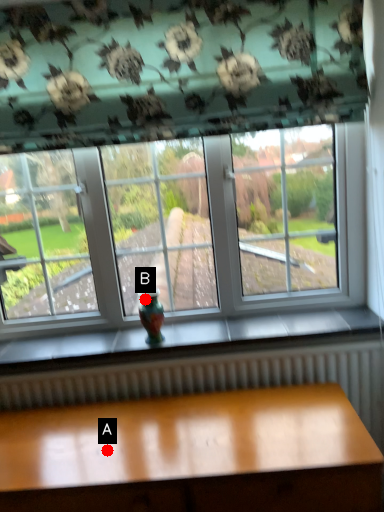
Question: Two points are circled on the image, labeled by A and B beside each circle. Which point is further to the camera?

Choices:
 (A) A is further
 (B) B is further

Answer: (B)